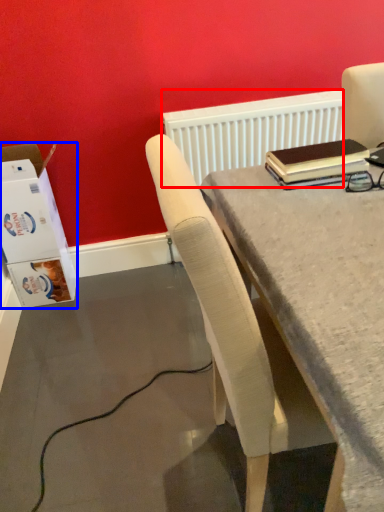
Question: Which object is further to the camera taking this photo, radiator (highlighted by a red box) or box (highlighted by a blue box)?

Choices:
 (A) radiator
 (B) box

Answer: (A)